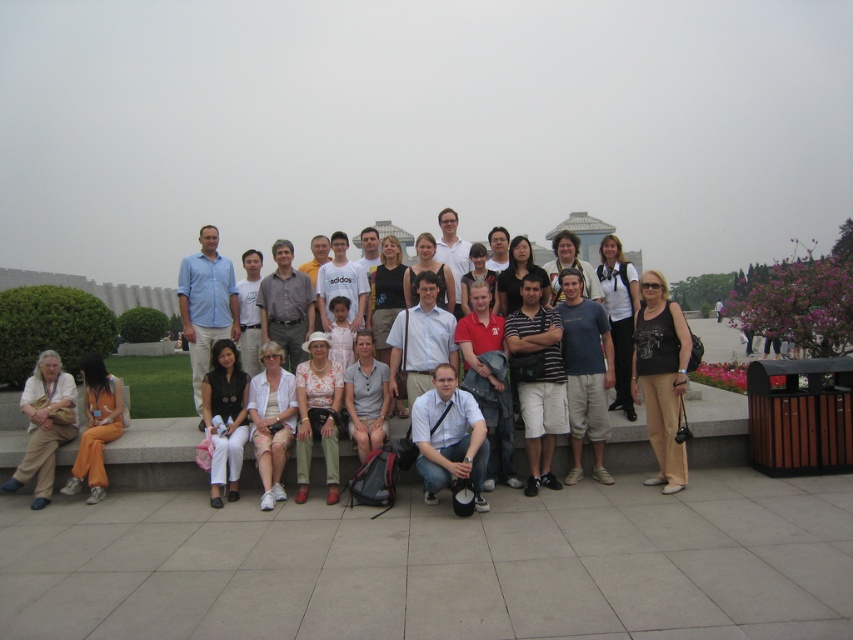
You are a photographer trying to adjust the spacing between the light beige pants at lower left and orange cotton pants at lower left to ensure they are exactly 50 centimeters apart. Given their current distance is 43.35 centimeters, how much more space in centimeters do you need to add between them?

The light beige pants at lower left and orange cotton pants at lower left are currently 43.35 centimeters apart. To reach the desired 50 centimeters, you need to add an additional 6.65 centimeters between them.